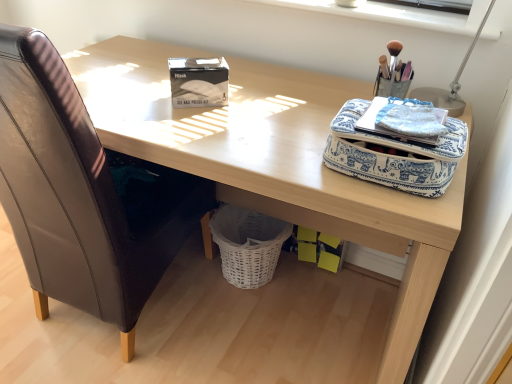
Find the location of a particular element. The image size is (512, 384). vacant space to the right of white wicker basket at lower center is located at coordinates (312, 287).